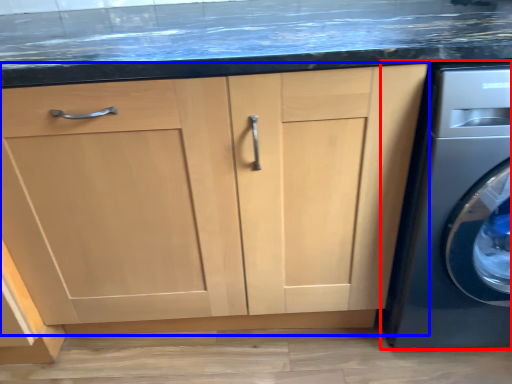
Question: Among these objects, which one is nearest to the camera, washing machine (highlighted by a red box) or cabinetry (highlighted by a blue box)?

Choices:
 (A) washing machine
 (B) cabinetry

Answer: (A)